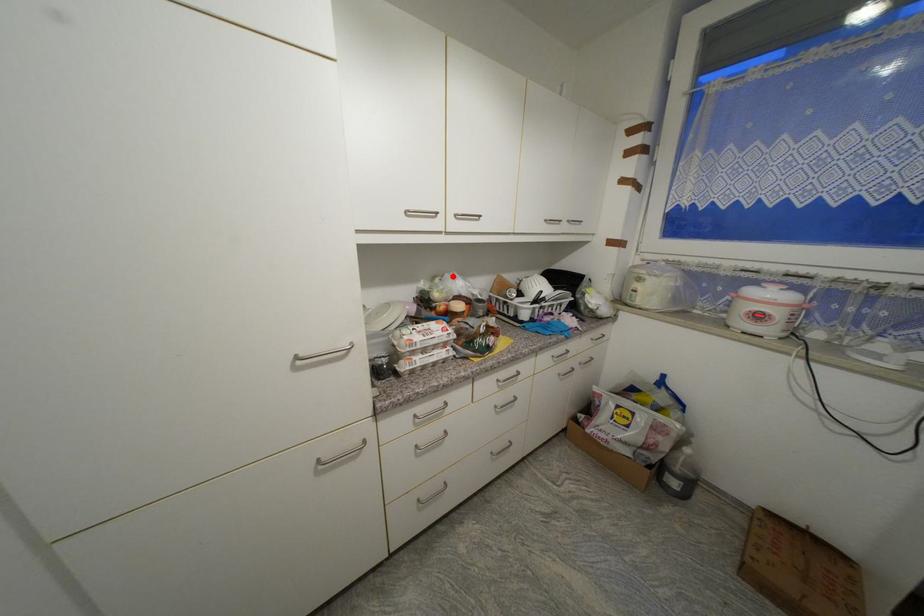
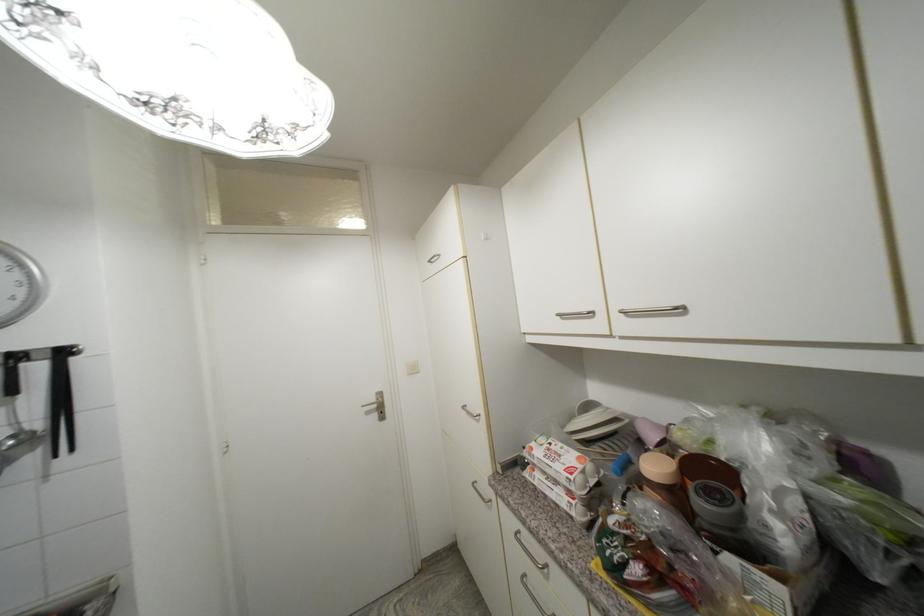
Locate, in the second image, the point that corresponds to the highlighted location in the first image.

(730, 410)